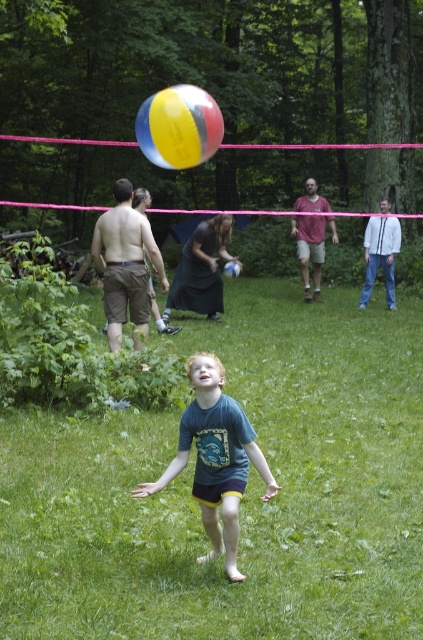
You are a photographer setting up a shot of the volleyball game. You need to ensure that the green grass at center and the matte black shorts at center are both in focus. Given that your camera can only focus on objects within a 1.5 meter width, will both objects fit within this focus range?

The green grass at center is wider than the matte black shorts at center. Since the camera can focus on objects within a 1.5 meter width, and the grass is wider, it might exceed the focus range. However, the shorts are narrower, so they would fit. Therefore, both may not fit together within the 1.5 meter width if the grass is too wide.

You are a volleyball player trying to hit the ball. You see the matte pink shirt at center and the multicolored rubber volleyball at center. Which object is closer to you?

The matte pink shirt at center is closer to you since it is only 2.65 meters away from the multicolored rubber volleyball at center.